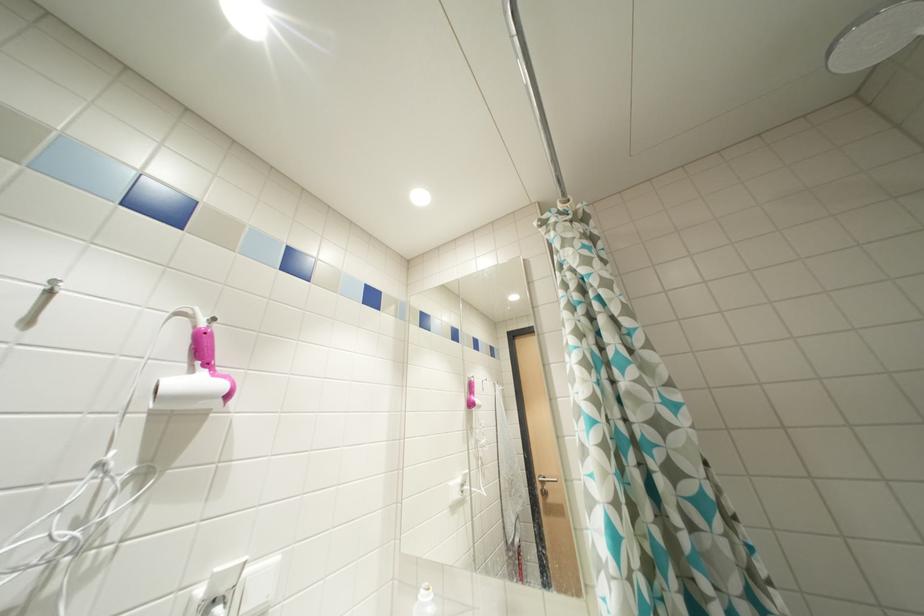
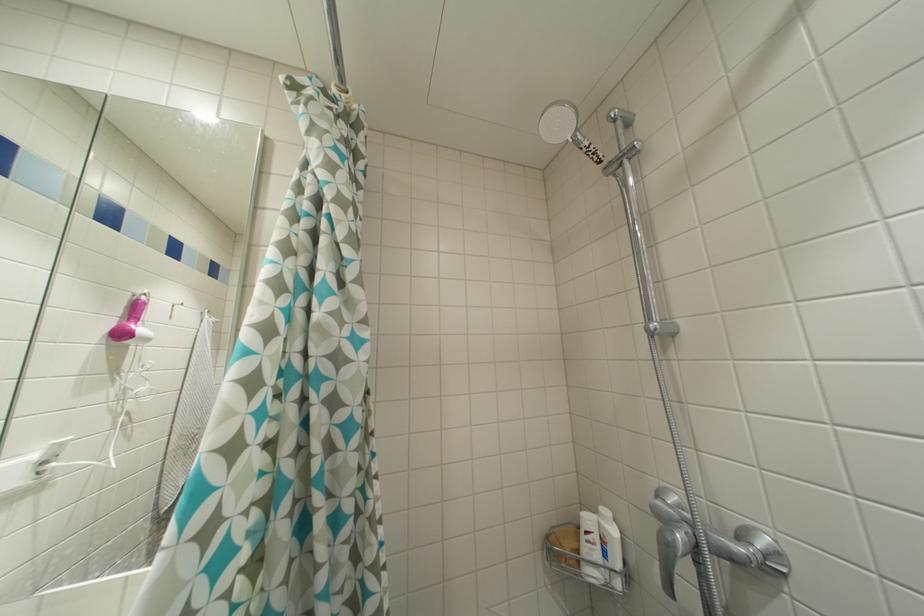
Question: The camera is either moving clockwise (left) or counter-clockwise (right) around the object. The first image is from the beginning of the video and the second image is from the end. Is the camera moving left or right when shooting the video?

Choices:
 (A) Left
 (B) Right

Answer: (A)